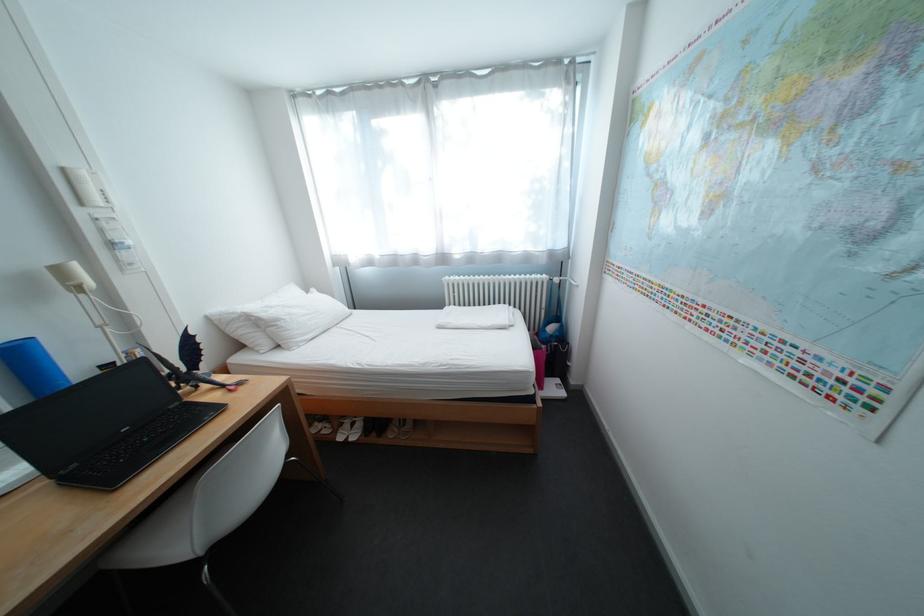
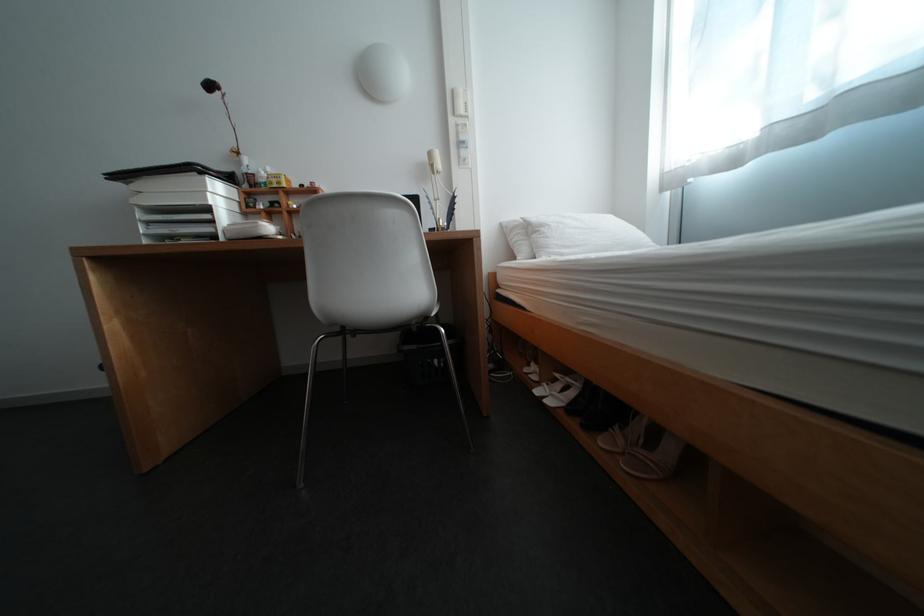
Locate, in the second image, the point that corresponds to pixel 372 435 in the first image.

(576, 406)